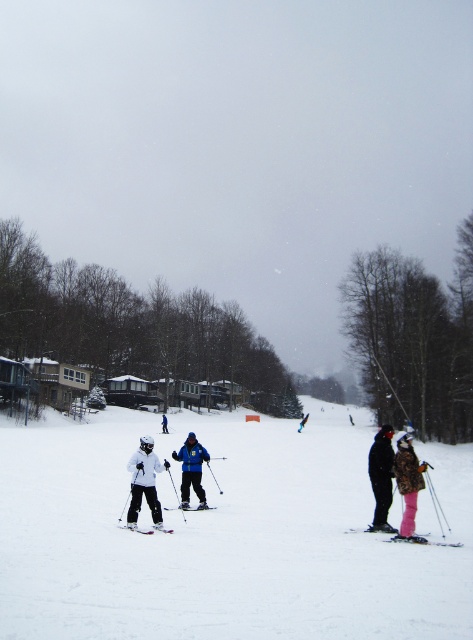
Question: Is matte black ski at center thinner than white matte snowboarder at center?

Choices:
 (A) no
 (B) yes

Answer: (B)

Question: Where is white matte snow at center located in relation to blue matte jacket at center in the image?

Choices:
 (A) below
 (B) above

Answer: (A)

Question: Which of the following is the closest to the observer?

Choices:
 (A) (137, 493)
 (B) (129, 428)
 (C) (164, 413)
 (D) (200, 472)

Answer: (A)

Question: Among these objects, which one is farthest from the camera?

Choices:
 (A) shiny blue snowboard at center
 (B) matte black ski at lower center
 (C) blue matte jacket at center
 (D) matte black ski at center

Answer: (A)

Question: Can you confirm if white matte snowsuit at center is smaller than white matte snowboarder at center?

Choices:
 (A) no
 (B) yes

Answer: (A)

Question: Which object appears farthest from the camera in this image?

Choices:
 (A) white matte snowsuit at center
 (B) blue matte jacket at center
 (C) white matte jacket at center

Answer: (A)